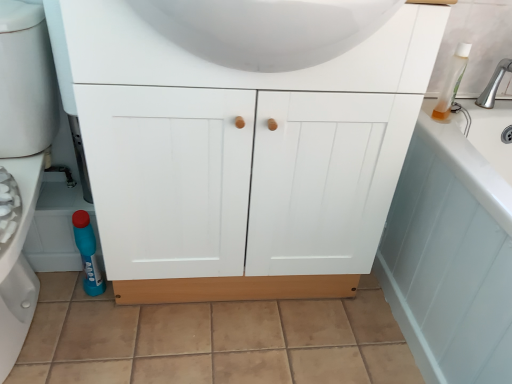
Identify the location of vacant space underneath white glossy sink at upper center (from a real-world perspective). This screenshot has width=512, height=384. (252, 331).